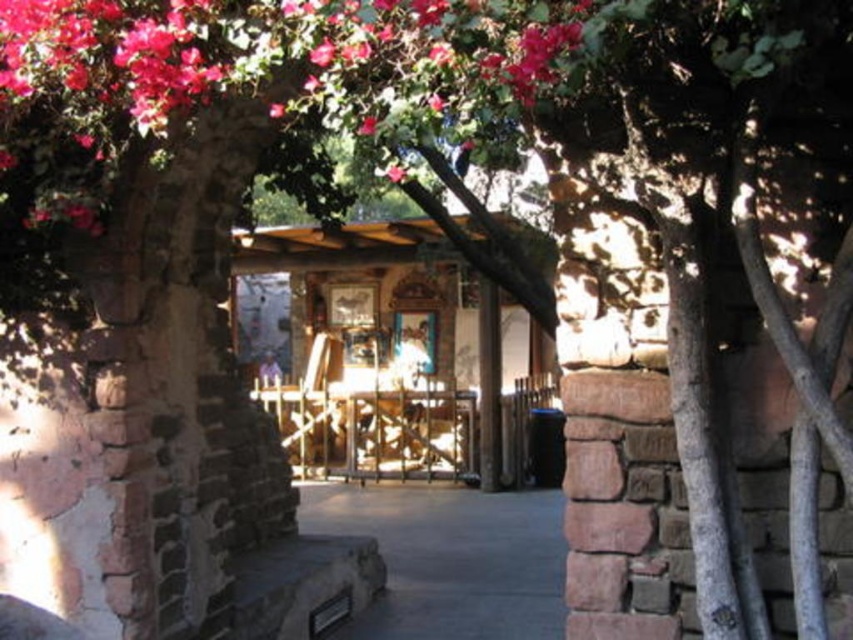
Consider the image. Who is positioned more to the right, vibrant pink petals at upper center or gray concrete pavement at center?

gray concrete pavement at center is more to the right.

Does vibrant pink petals at upper center come in front of gray concrete pavement at center?

Yes, it is in front of gray concrete pavement at center.

You are a GUI agent. You are given a task and a screenshot of the screen. Output one action in this format:
    pyautogui.click(x=<x>, y=<y>)
    Task: Click on the vibrant pink petals at upper center
    This screenshot has height=640, width=853.
    Given the screenshot: What is the action you would take?
    pyautogui.click(x=288, y=60)

The image size is (853, 640). In order to click on vibrant pink petals at upper center in this screenshot , I will do `click(288, 60)`.